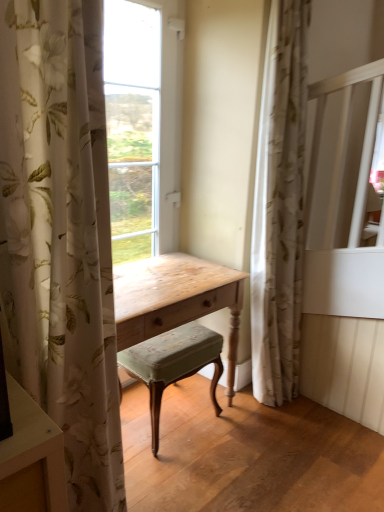
Question: Is white floral fabric curtain at left, the second curtain when ordered from right to left, not inside velvet green cushioned stool at center?

Choices:
 (A) yes
 (B) no

Answer: (A)

Question: From a real-world perspective, is white floral fabric curtain at left, arranged as the 1th curtain when viewed from the front, positioned over velvet green cushioned stool at center based on gravity?

Choices:
 (A) yes
 (B) no

Answer: (A)

Question: Can you confirm if white floral fabric curtain at left, marked as the first curtain in a left-to-right arrangement, is taller than velvet green cushioned stool at center?

Choices:
 (A) yes
 (B) no

Answer: (A)

Question: Considering the relative positions of white floral fabric curtain at left, arranged as the 1th curtain when viewed from the front, and velvet green cushioned stool at center in the image provided, is white floral fabric curtain at left, arranged as the 1th curtain when viewed from the front, to the right of velvet green cushioned stool at center from the viewer's perspective?

Choices:
 (A) no
 (B) yes

Answer: (A)

Question: From the image's perspective, does white floral fabric curtain at left, which appears as the 2th curtain when viewed from the back, appear higher than velvet green cushioned stool at center?

Choices:
 (A) yes
 (B) no

Answer: (A)

Question: From a real-world perspective, is white floral fabric curtain at left, marked as the first curtain in a left-to-right arrangement, under velvet green cushioned stool at center?

Choices:
 (A) yes
 (B) no

Answer: (B)

Question: From the image's perspective, is velvet green cushioned stool at center beneath white floral fabric curtain at left, arranged as the 1th curtain when viewed from the front?

Choices:
 (A) yes
 (B) no

Answer: (A)

Question: Is velvet green cushioned stool at center at the right side of white floral fabric curtain at left, which appears as the 2th curtain when viewed from the back?

Choices:
 (A) no
 (B) yes

Answer: (B)

Question: From a real-world perspective, is velvet green cushioned stool at center on white floral fabric curtain at left, arranged as the 1th curtain when viewed from the front?

Choices:
 (A) yes
 (B) no

Answer: (B)

Question: Is velvet green cushioned stool at center behind white floral fabric curtain at left, which appears as the 2th curtain when viewed from the back?

Choices:
 (A) yes
 (B) no

Answer: (A)

Question: Considering the relative sizes of velvet green cushioned stool at center and white floral fabric curtain at left, arranged as the 1th curtain when viewed from the front, in the image provided, is velvet green cushioned stool at center bigger than white floral fabric curtain at left, arranged as the 1th curtain when viewed from the front,?

Choices:
 (A) no
 (B) yes

Answer: (A)

Question: Is white floral fabric curtain at left, marked as the first curtain in a left-to-right arrangement, at the back of velvet green cushioned stool at center?

Choices:
 (A) yes
 (B) no

Answer: (B)

Question: Considering the relative sizes of velvet green cushioned stool at center and floral sheer curtain at right, which ranks as the second curtain in left-to-right order, in the image provided, is velvet green cushioned stool at center thinner than floral sheer curtain at right, which ranks as the second curtain in left-to-right order,?

Choices:
 (A) no
 (B) yes

Answer: (A)